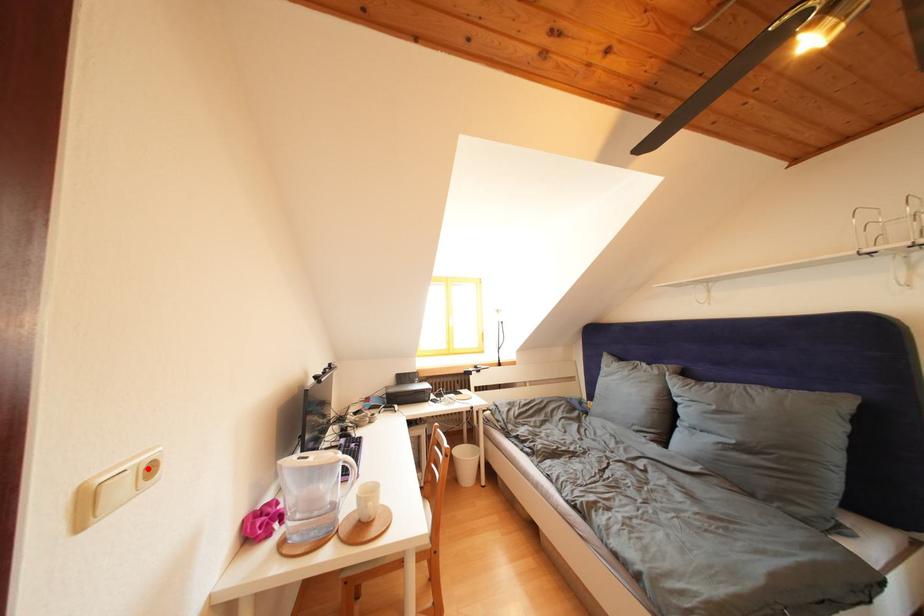
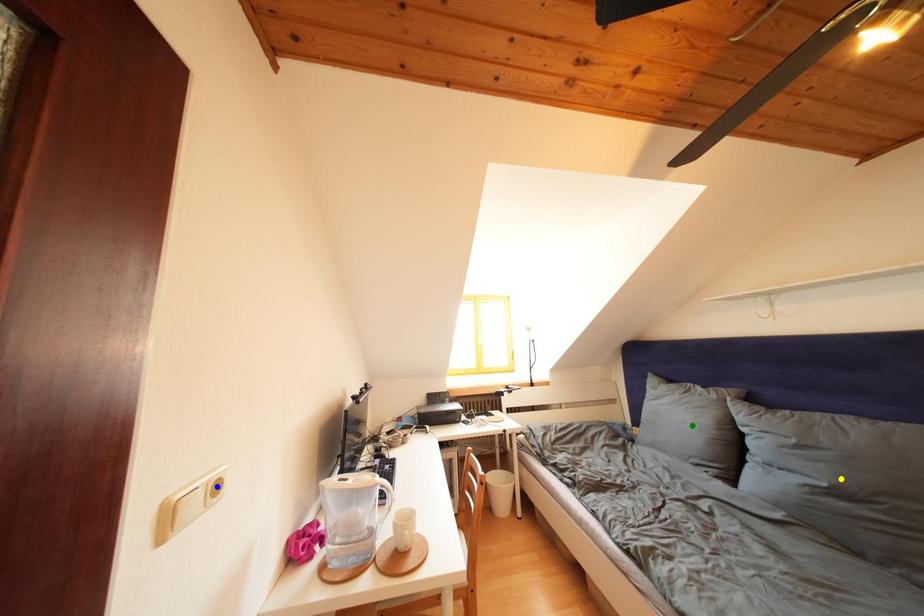
Question: I am providing you with two images of the same scene from different viewpoints. A red point is marked on the first image. You are given multiple points on the second image. Which point in image 2 represents the same 3d spot as the red point in image 1?

Choices:
 (A) green point
 (B) yellow point
 (C) blue point

Answer: (C)